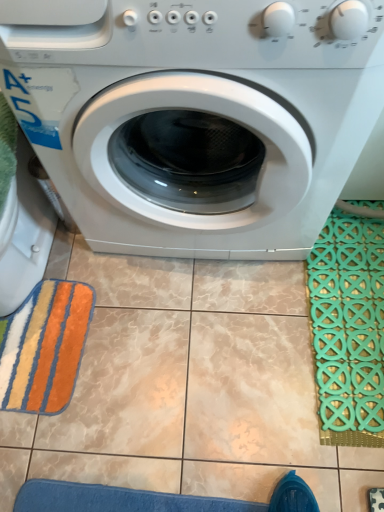
Question: In terms of size, does white glossy washing machine at center appear bigger or smaller than green rubber bath mat at right?

Choices:
 (A) big
 (B) small

Answer: (A)

Question: In the image, is white glossy washing machine at center on the left side or the right side of green rubber bath mat at right?

Choices:
 (A) right
 (B) left

Answer: (B)

Question: Which is nearer to the multicolored plush bath towel at lower left?

Choices:
 (A) green rubber bath mat at right
 (B) white glossy washing machine at center

Answer: (B)

Question: Which of these objects is positioned farthest from the green rubber bath mat at right?

Choices:
 (A) multicolored plush bath towel at lower left
 (B) white glossy washing machine at center

Answer: (A)